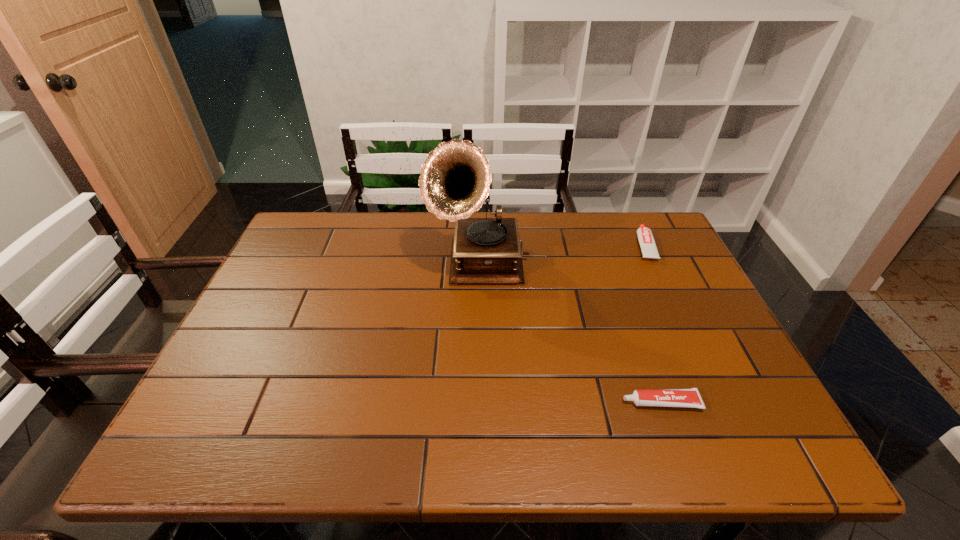
You are a GUI agent. You are given a task and a screenshot of the screen. Output one action in this format:
    pyautogui.click(x=<x>, y=<y>)
    Task: Click on the free spot between the leftmost object and the farther toothpaste
    
    Given the screenshot: What is the action you would take?
    pyautogui.click(x=562, y=256)

Find the location of a particular element. free space between the rightmost object and the record player is located at coordinates (562, 256).

The image size is (960, 540). I want to click on empty space between the nearest object and the farther toothpaste, so click(653, 324).

This screenshot has height=540, width=960. In order to click on blank region between the record player and the right toothpaste in this screenshot , I will do pos(562,256).

Image resolution: width=960 pixels, height=540 pixels. I want to click on vacant space that is in between the rightmost object and the nearer toothpaste, so click(x=653, y=324).

Locate an element on the screen. This screenshot has width=960, height=540. vacant space that is in between the left toothpaste and the rightmost object is located at coordinates (653, 324).

This screenshot has height=540, width=960. Identify the location of free space between the left toothpaste and the rightmost object. click(653, 324).

Identify the location of vacant area that lies between the leftmost object and the farther toothpaste. Image resolution: width=960 pixels, height=540 pixels. (562, 256).

At what (x,y) coordinates should I click in order to perform the action: click on empty space that is in between the tallest object and the nearer toothpaste. Please return your answer as a coordinate pair (x, y). Looking at the image, I should click on (569, 334).

This screenshot has height=540, width=960. I want to click on vacant region between the right toothpaste and the second object from left to right, so click(653, 324).